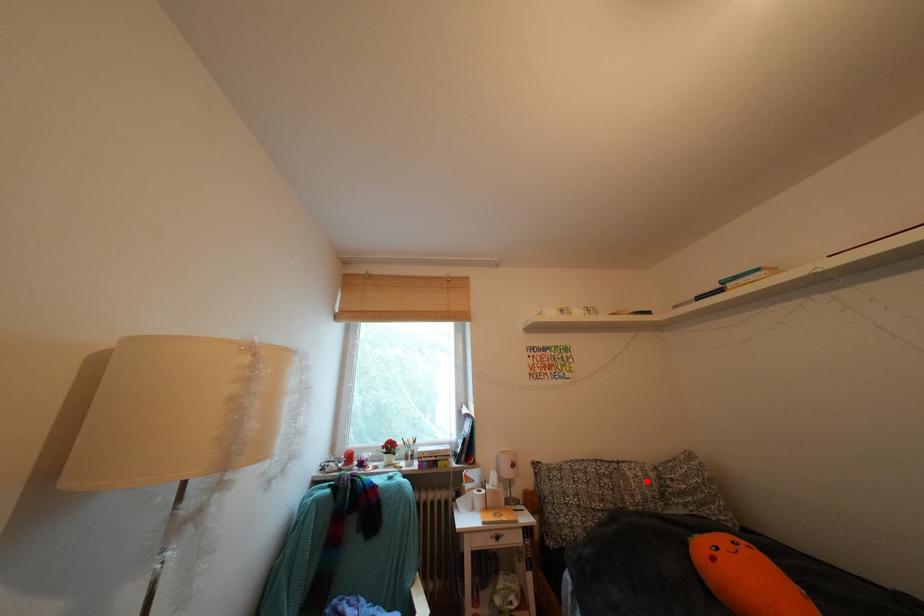
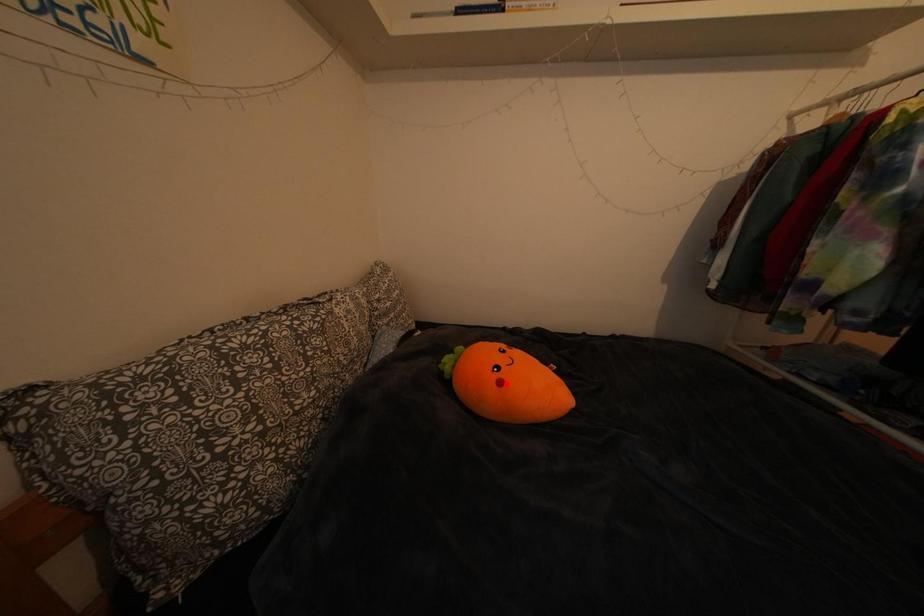
Based on the photo, I am providing you with two images of the same scene from different viewpoints. A red point is marked on the first image and another point is marked on the second image. Are the points marked in image1 and image2 representing the same 3D position?

No